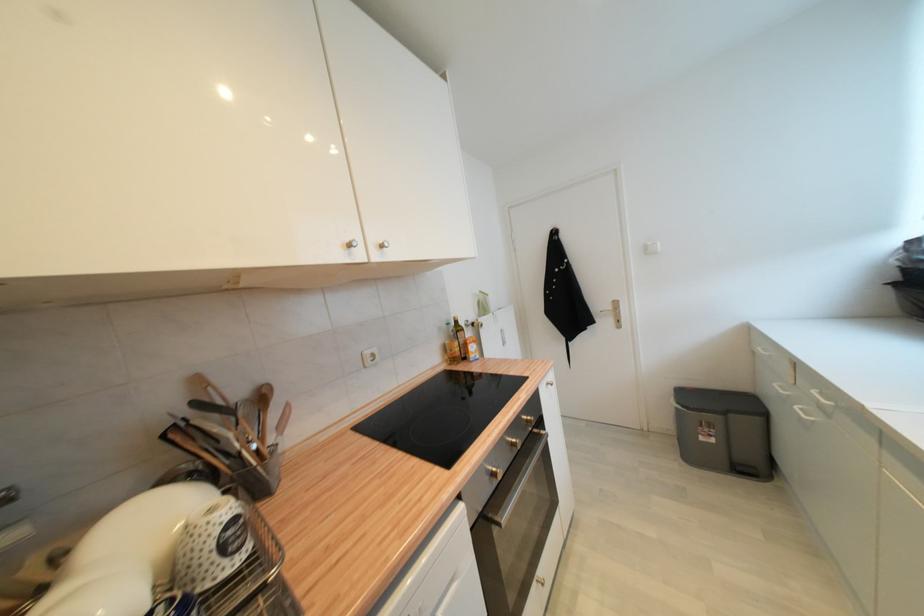
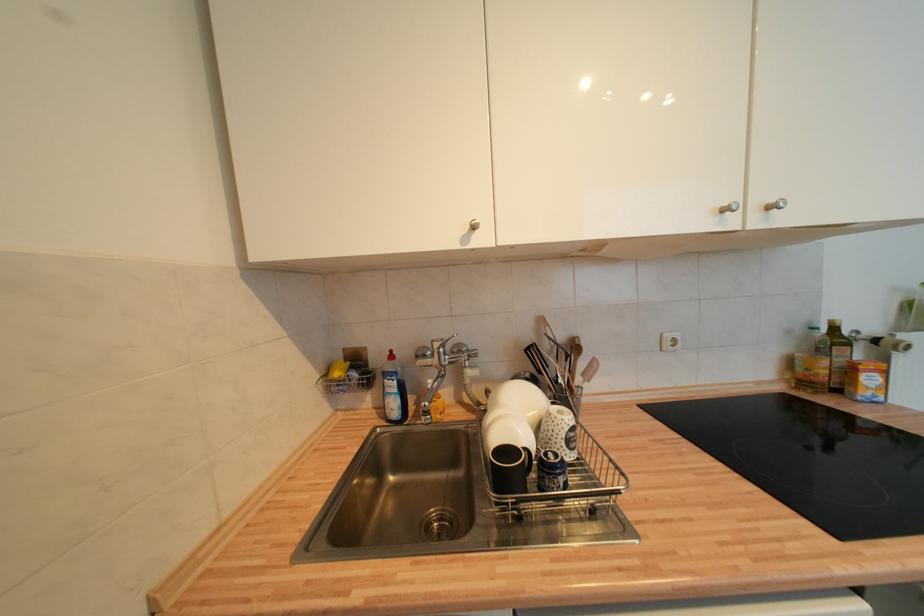
In the second image, find the point that corresponds to point (414, 458) in the first image.

(742, 477)